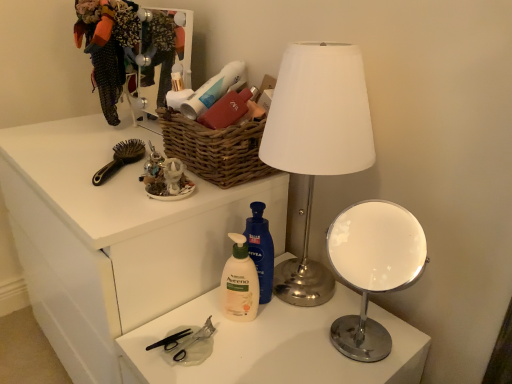
Locate an element on the screen. vacant space behind black plastic brush at upper left is located at coordinates (106, 146).